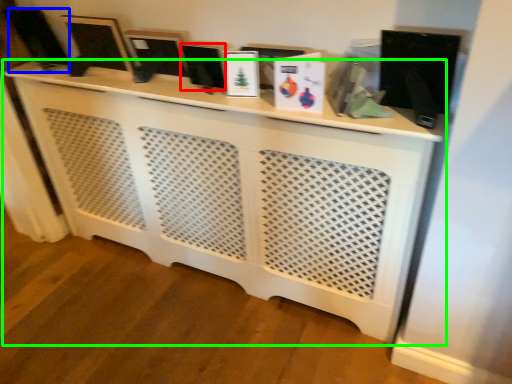
Question: Estimate the real-world distances between objects in this image. Which object is closer to computer monitor (highlighted by a red box), computer monitor (highlighted by a blue box) or furniture (highlighted by a green box)?

Choices:
 (A) computer monitor
 (B) furniture

Answer: (B)